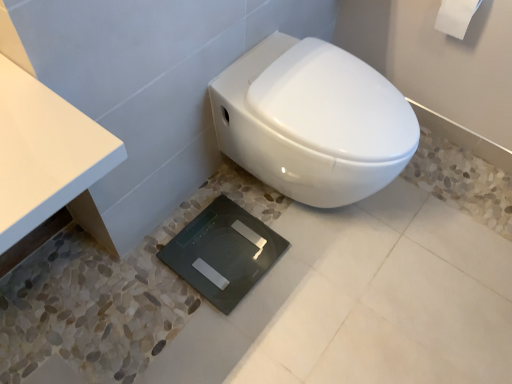
Question: Does white matte toilet paper at upper right have a lesser width compared to white glossy toilet at center?

Choices:
 (A) yes
 (B) no

Answer: (A)

Question: Considering the relative sizes of white matte toilet paper at upper right and white glossy toilet at center in the image provided, is white matte toilet paper at upper right wider than white glossy toilet at center?

Choices:
 (A) yes
 (B) no

Answer: (B)

Question: Is white matte toilet paper at upper right oriented towards white glossy toilet at center?

Choices:
 (A) yes
 (B) no

Answer: (A)

Question: Does white matte toilet paper at upper right appear on the right side of white glossy toilet at center?

Choices:
 (A) yes
 (B) no

Answer: (A)

Question: Is white glossy toilet at center at the back of white matte toilet paper at upper right?

Choices:
 (A) yes
 (B) no

Answer: (B)

Question: In terms of size, does white matte toilet paper at upper right appear bigger or smaller than white glossy toilet at center?

Choices:
 (A) big
 (B) small

Answer: (B)

Question: From the image's perspective, relative to white glossy toilet at center, is white matte toilet paper at upper right above or below?

Choices:
 (A) above
 (B) below

Answer: (A)

Question: In terms of height, does white matte toilet paper at upper right look taller or shorter compared to white glossy toilet at center?

Choices:
 (A) tall
 (B) short

Answer: (B)

Question: Looking at their shapes, would you say white matte toilet paper at upper right is wider or thinner than white glossy toilet at center?

Choices:
 (A) thin
 (B) wide

Answer: (A)

Question: Considering their positions, is white glossy toilet at center located in front of or behind black glass scale at center?

Choices:
 (A) front
 (B) behind

Answer: (A)

Question: In terms of width, does white glossy toilet at center look wider or thinner when compared to black glass scale at center?

Choices:
 (A) thin
 (B) wide

Answer: (B)

Question: Is white glossy toilet at center situated inside black glass scale at center or outside?

Choices:
 (A) outside
 (B) inside

Answer: (A)

Question: From the image's perspective, is white glossy toilet at center positioned above or below black glass scale at center?

Choices:
 (A) below
 (B) above

Answer: (B)

Question: Considering the relative positions of black glass scale at center and white glossy toilet at center in the image provided, is black glass scale at center to the left or to the right of white glossy toilet at center?

Choices:
 (A) right
 (B) left

Answer: (B)

Question: From the image's perspective, is black glass scale at center above or below white glossy toilet at center?

Choices:
 (A) above
 (B) below

Answer: (B)